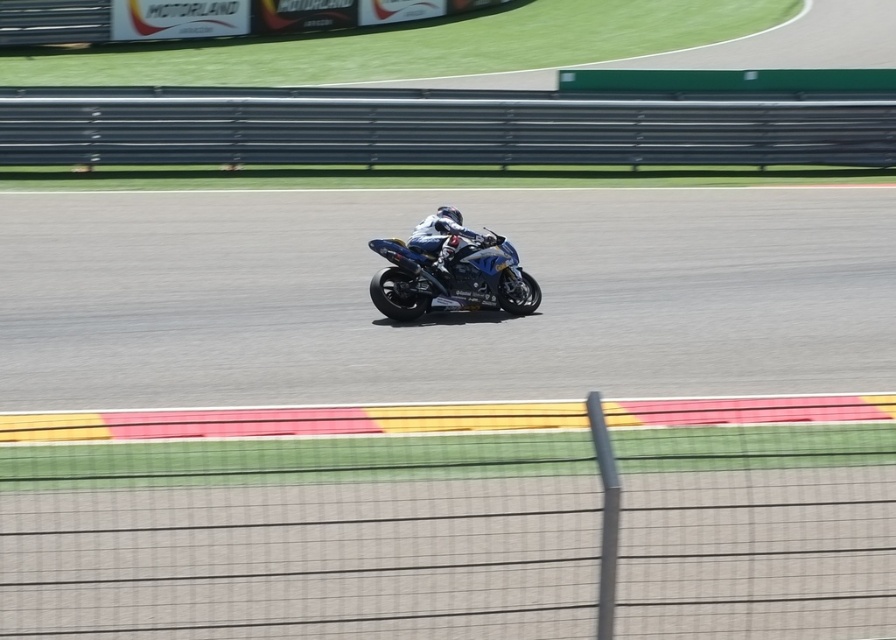
Between blue metallic motorcycle at center and white matte helmet at center, which one is positioned lower?

blue metallic motorcycle at center

Does blue metallic motorcycle at center have a lesser width compared to white matte helmet at center?

No.

This screenshot has width=896, height=640. Describe the element at coordinates (451, 280) in the screenshot. I see `blue metallic motorcycle at center` at that location.

This screenshot has width=896, height=640. I want to click on blue metallic motorcycle at center, so click(x=451, y=280).